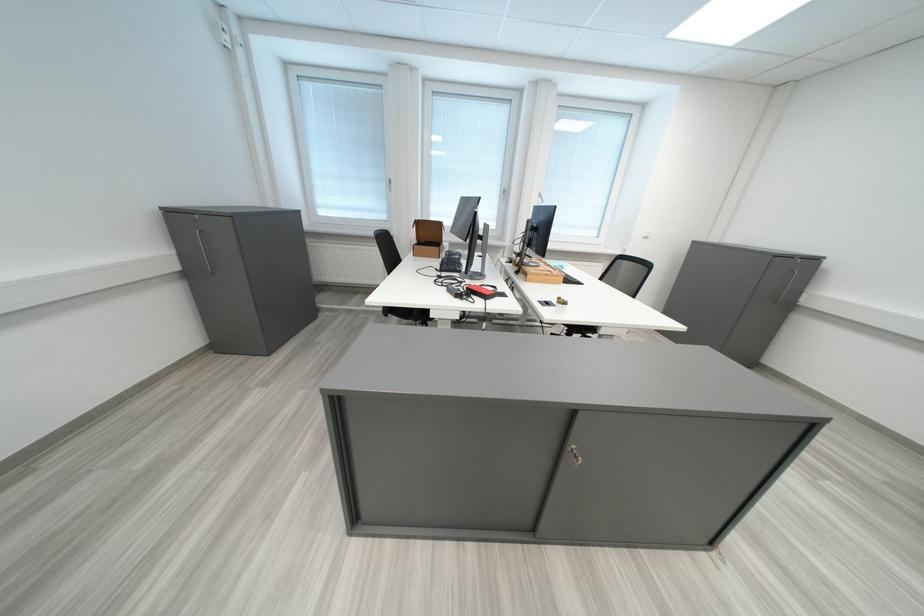
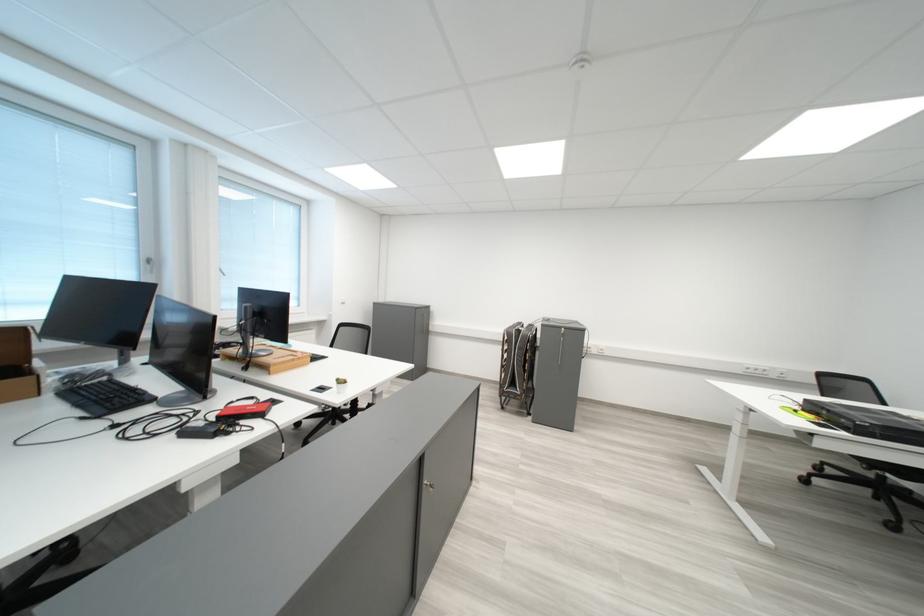
Question: The camera is either moving clockwise (left) or counter-clockwise (right) around the object. The first image is from the beginning of the video and the second image is from the end. Is the camera moving left or right when shooting the video?

Choices:
 (A) Left
 (B) Right

Answer: (A)